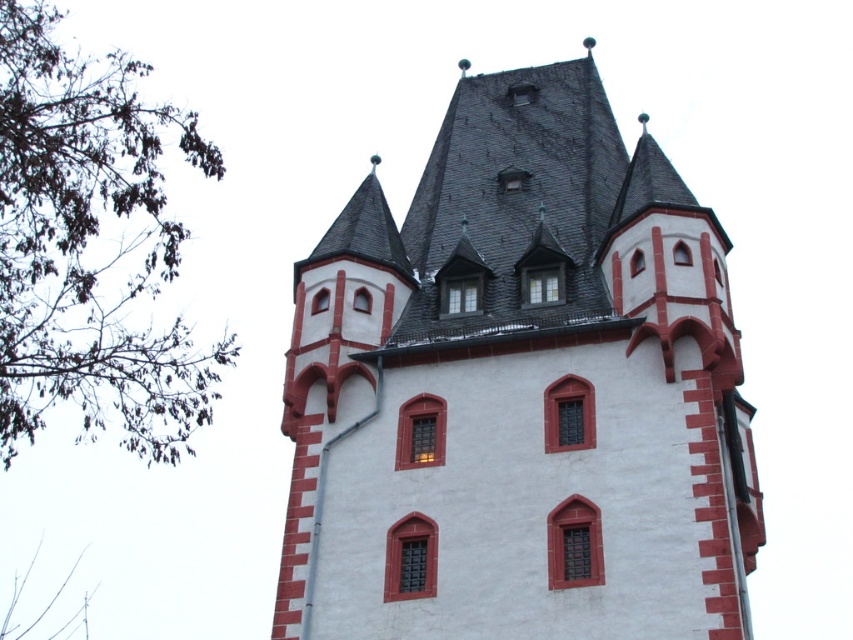
Question: Is white stucco tower at center further to the viewer compared to green leafy branches at left?

Choices:
 (A) yes
 (B) no

Answer: (B)

Question: Does white stucco tower at center have a larger size compared to green leafy branches at left?

Choices:
 (A) no
 (B) yes

Answer: (A)

Question: Which point appears farthest from the camera in this image?

Choices:
 (A) (699, 534)
 (B) (7, 113)

Answer: (B)

Question: Which point is closer to the camera?

Choices:
 (A) white stucco tower at center
 (B) green leafy branches at left

Answer: (A)

Question: Can you confirm if white stucco tower at center is thinner than green leafy branches at left?

Choices:
 (A) no
 (B) yes

Answer: (B)